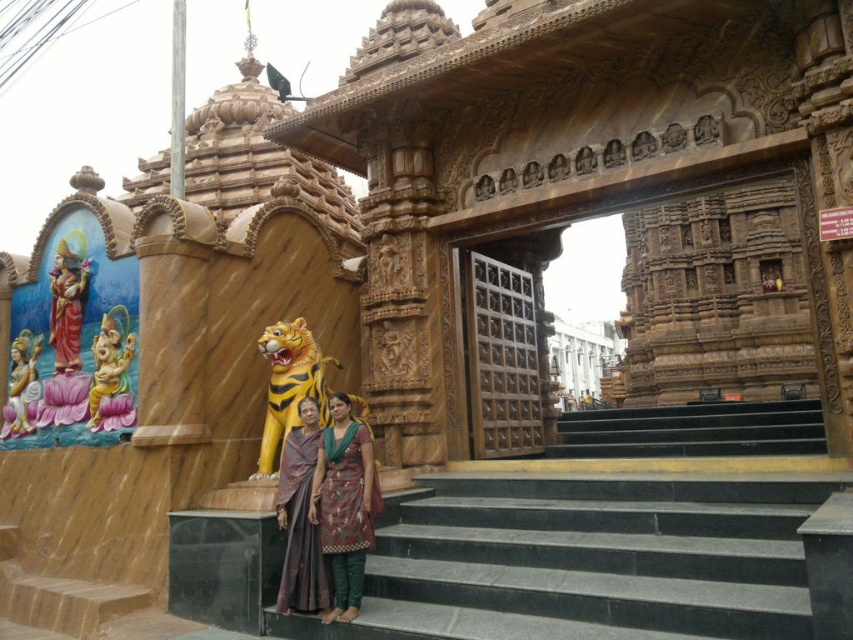
Can you confirm if yellow painted wood tiger statue at center is shorter than polished gold statue at left?

No, yellow painted wood tiger statue at center is not shorter than polished gold statue at left.

Does yellow painted wood tiger statue at center appear under polished gold statue at left?

Yes, yellow painted wood tiger statue at center is below polished gold statue at left.

The height and width of the screenshot is (640, 853). I want to click on yellow painted wood tiger statue at center, so click(289, 385).

Locate an element on the screen. Image resolution: width=853 pixels, height=640 pixels. yellow painted wood tiger statue at center is located at coordinates [x=289, y=385].

Looking at this image, between black granite stairs at center and golden statue at left, which one is positioned lower?

black granite stairs at center is lower down.

Is point (477, 600) in front of point (33, 392)?

Yes, it is in front of point (33, 392).

Who is more forward, (589, 612) or (22, 381)?

Point (589, 612) is in front.

Locate an element on the screen. black granite stairs at center is located at coordinates (589, 560).

Does polished gold statue at left come behind golden stone elephant at lower left?

Yes, polished gold statue at left is further from the viewer.

Which is above, polished gold statue at left or golden stone elephant at lower left?

polished gold statue at left is above.

This screenshot has height=640, width=853. In order to click on polished gold statue at left in this screenshot , I will do `click(67, 307)`.

The width and height of the screenshot is (853, 640). Identify the location of polished gold statue at left. (67, 307).